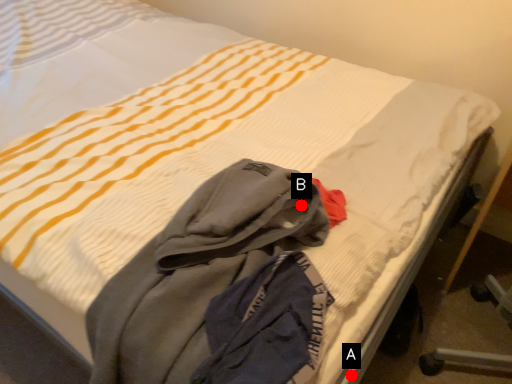
Question: Two points are circled on the image, labeled by A and B beside each circle. Which point is closer to the camera?

Choices:
 (A) A is closer
 (B) B is closer

Answer: (A)